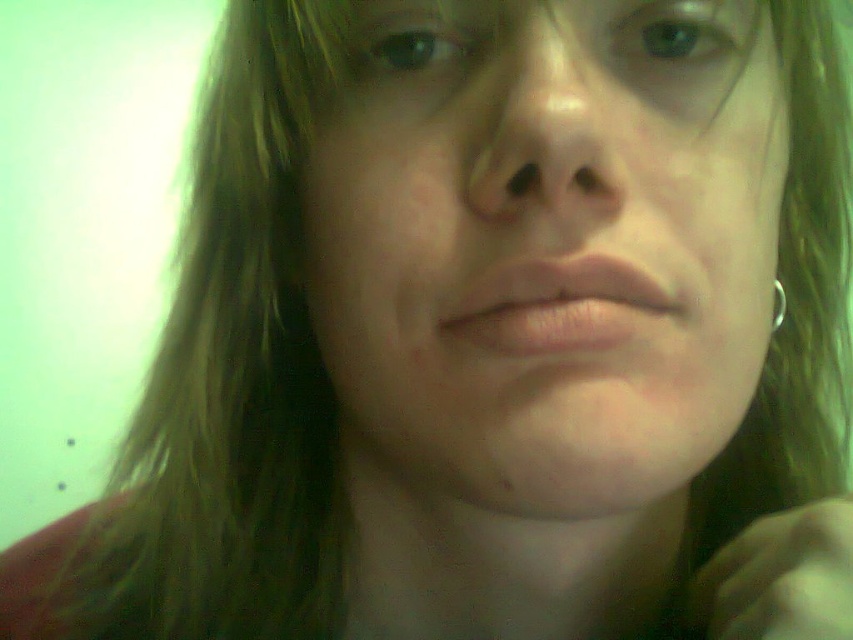
Does point (579, 340) come in front of point (772, 330)?

That is True.

Who is more distant from viewer, [469,289] or [785,310]?

Positioned behind is point [785,310].

Is point (560, 266) positioned after point (775, 317)?

No, (560, 266) is closer to viewer.

Identify the location of pink matte lips at center. The width and height of the screenshot is (853, 640). (560, 305).

Does smooth skin face at center lie in front of pink matte lips at center?

Yes.

Does smooth skin face at center appear over pink matte lips at center?

Yes, smooth skin face at center is above pink matte lips at center.

I want to click on smooth skin face at center, so click(x=546, y=244).

Does point (691, 234) come in front of point (775, 317)?

Yes, it is in front of point (775, 317).

Consider the image. Who is more distant from viewer, (703,316) or (778,285)?

The point (778,285) is behind.

You are a GUI agent. You are given a task and a screenshot of the screen. Output one action in this format:
    pyautogui.click(x=<x>, y=<y>)
    Task: Click on the smooth skin face at center
    This screenshot has height=640, width=853.
    Given the screenshot: What is the action you would take?
    pyautogui.click(x=546, y=244)